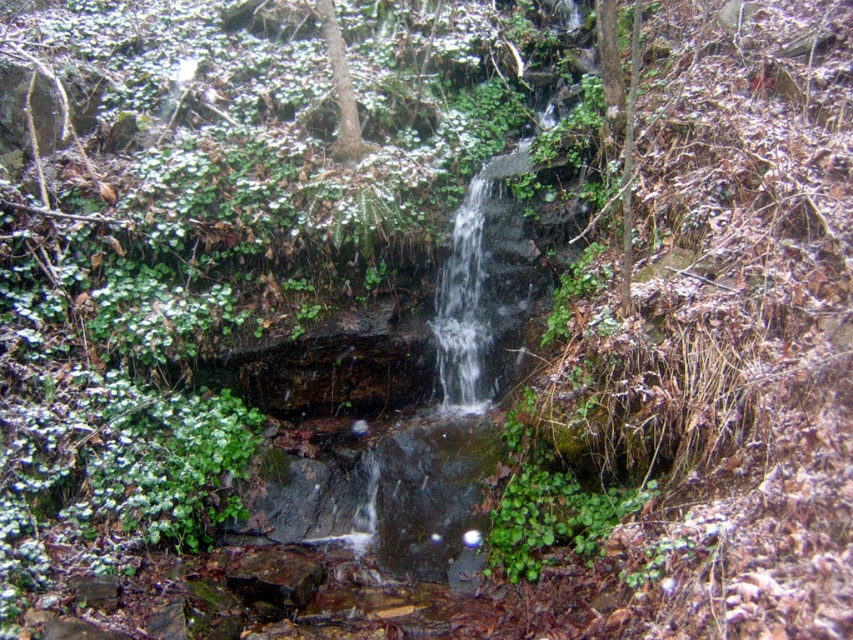
Question: Which object is closer to the camera taking this photo?

Choices:
 (A) green leafy tree at center
 (B) brown rough tree at center

Answer: (B)

Question: In this image, where is brown rough tree at center located relative to green leafy tree at center?

Choices:
 (A) left
 (B) right

Answer: (A)

Question: Which object appears farthest from the camera in this image?

Choices:
 (A) green leafy tree at center
 (B) brown rough tree at center

Answer: (A)

Question: Is brown rough tree at center positioned before green leafy tree at center?

Choices:
 (A) yes
 (B) no

Answer: (A)

Question: In this image, where is brown rough tree at center located relative to green leafy tree at center?

Choices:
 (A) left
 (B) right

Answer: (A)

Question: Which point is closer to the camera?

Choices:
 (A) green leafy tree at center
 (B) brown rough tree at center

Answer: (B)